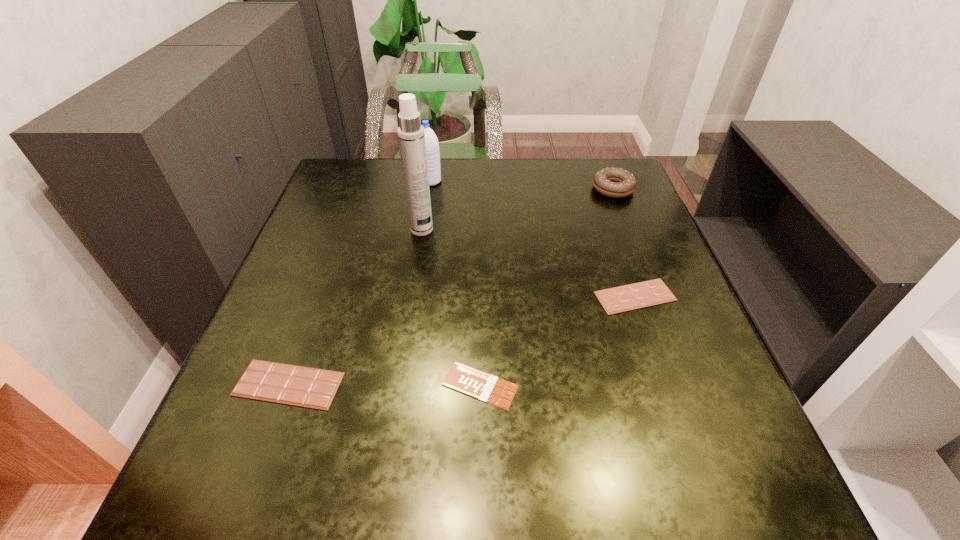
At what (x,y) coordinates should I click in order to perform the action: click on empty space that is in between the farthest chocolate bar and the water bottle. Please return your answer as a coordinate pair (x, y). Looking at the image, I should click on (533, 239).

The height and width of the screenshot is (540, 960). What are the coordinates of `vacant point located between the fourth farthest object and the water bottle` in the screenshot? It's located at (533, 239).

Locate an element on the screen. Image resolution: width=960 pixels, height=540 pixels. empty space between the fourth nearest object and the fourth shortest object is located at coordinates (517, 209).

Identify the location of empty space between the fourth shortest object and the tallest object. (517, 209).

At what (x,y) coordinates should I click in order to perform the action: click on vacant space that is in between the farthest chocolate bar and the water bottle. Please return your answer as a coordinate pair (x, y). Looking at the image, I should click on (533, 239).

I want to click on empty space between the leftmost object and the third tallest object, so click(x=451, y=287).

Where is `the fourth closest object to the shortest chocolate bar`? the fourth closest object to the shortest chocolate bar is located at coordinates (613, 182).

Locate an element on the screen. the fourth closest object to the rightmost chocolate bar is located at coordinates point(301,386).

Identify which chocolate bar is the nearest to the rightmost chocolate bar. Please provide its 2D coordinates. Your answer should be formatted as a tuple, i.e. [(x, y)], where the tuple contains the x and y coordinates of a point satisfying the conditions above.

[(470, 381)]

Where is `chocolate bar that is the third closest to the aerosol can`? This screenshot has height=540, width=960. chocolate bar that is the third closest to the aerosol can is located at coordinates (620, 299).